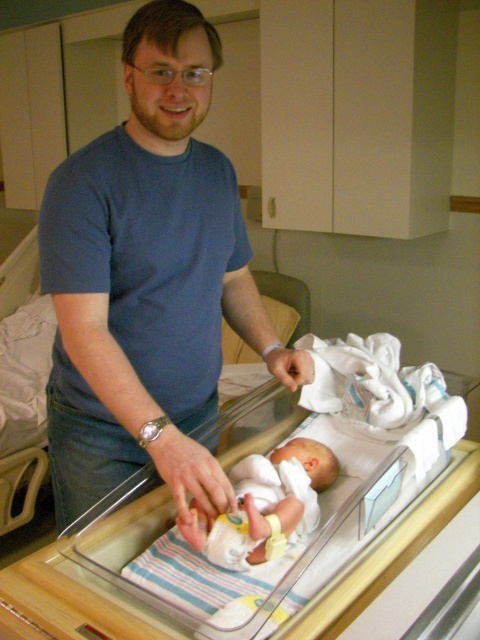
Question: Does blue cotton shirt at upper left have a smaller size compared to white fabric infant bed at center?

Choices:
 (A) yes
 (B) no

Answer: (B)

Question: Which point is closer to the camera taking this photo?

Choices:
 (A) (228, 408)
 (B) (111, 314)

Answer: (B)

Question: Which object is the closest to the white fabric infant bed at center?

Choices:
 (A) white soft newborn at center
 (B) blue cotton shirt at upper left

Answer: (A)

Question: Is blue cotton shirt at upper left to the right of white soft newborn at center from the viewer's perspective?

Choices:
 (A) no
 (B) yes

Answer: (A)

Question: Can you confirm if blue cotton shirt at upper left is positioned to the right of white fabric infant bed at center?

Choices:
 (A) yes
 (B) no

Answer: (B)

Question: Among these objects, which one is nearest to the camera?

Choices:
 (A) white soft newborn at center
 (B) blue cotton shirt at upper left
 (C) white fabric infant bed at center

Answer: (C)